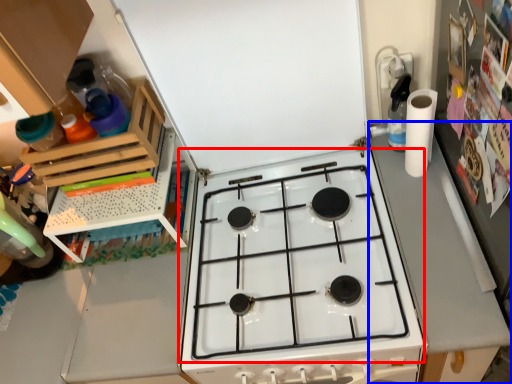
Question: Which point is further to the camera, gas stove (highlighted by a red box) or counter top (highlighted by a blue box)?

Choices:
 (A) gas stove
 (B) counter top

Answer: (A)